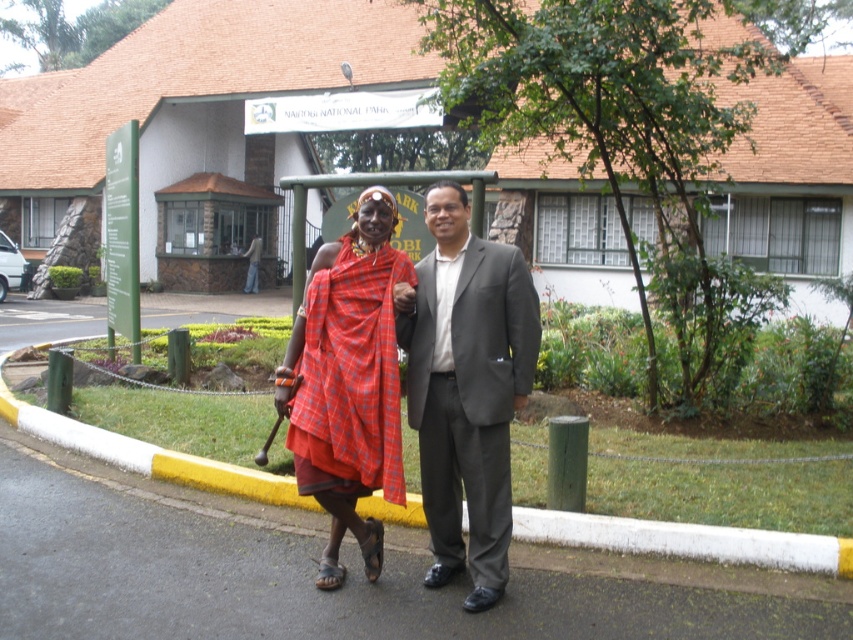
Question: Can you confirm if matte gray suit at center is positioned to the right of yellow rubber curb at lower center?

Choices:
 (A) no
 (B) yes

Answer: (A)

Question: Which object is the closest to the yellow rubber curb at lower center?

Choices:
 (A) matte gray suit at center
 (B) red plaid cloth at center

Answer: (A)

Question: Which of the following is the farthest from the observer?

Choices:
 (A) (109, 432)
 (B) (515, 339)
 (C) (387, 310)

Answer: (A)

Question: Can you confirm if red plaid cloth at center is bigger than yellow rubber curb at lower center?

Choices:
 (A) yes
 (B) no

Answer: (A)

Question: Which object is closer to the camera taking this photo?

Choices:
 (A) matte gray suit at center
 (B) red plaid cloth at center
 (C) yellow rubber curb at lower center

Answer: (A)

Question: Does matte gray suit at center have a lesser width compared to yellow rubber curb at lower center?

Choices:
 (A) yes
 (B) no

Answer: (B)